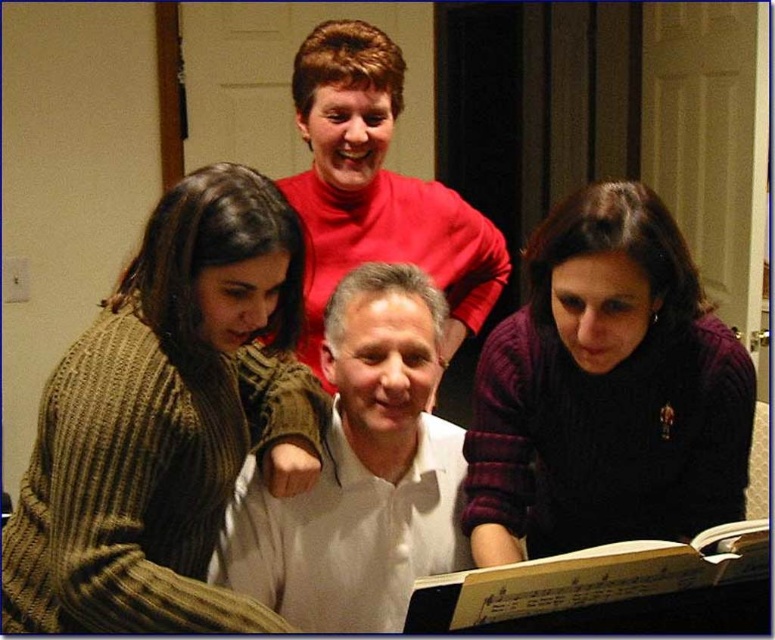
Does white matte shirt at center come behind yellow paper music book at lower center?

Yes, white matte shirt at center is behind yellow paper music book at lower center.

Which of these two, white matte shirt at center or yellow paper music book at lower center, stands taller?

Standing taller between the two is white matte shirt at center.

Locate an element on the screen. white matte shirt at center is located at coordinates (360, 474).

Between green knitted sweater at left and white matte shirt at center, which one has more height?

With more height is green knitted sweater at left.

Is green knitted sweater at left bigger than white matte shirt at center?

Yes, green knitted sweater at left is bigger than white matte shirt at center.

Describe the element at coordinates (164, 420) in the screenshot. The image size is (775, 640). I see `green knitted sweater at left` at that location.

This screenshot has width=775, height=640. What are the coordinates of `green knitted sweater at left` in the screenshot? It's located at (164, 420).

Can you confirm if dark purple sweater at lower right is taller than yellow paper music book at lower center?

Yes, dark purple sweater at lower right is taller than yellow paper music book at lower center.

Which is below, dark purple sweater at lower right or yellow paper music book at lower center?

yellow paper music book at lower center is lower down.

Is point (636, 532) in front of point (527, 620)?

No, (636, 532) is behind (527, 620).

Where is `dark purple sweater at lower right`? dark purple sweater at lower right is located at coordinates (605, 392).